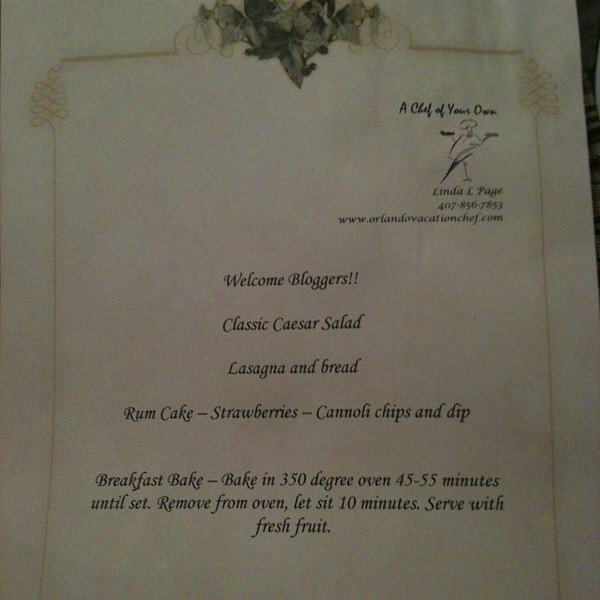
Identify the location of decorative line. The width and height of the screenshot is (600, 600). (540, 89), (49, 98).